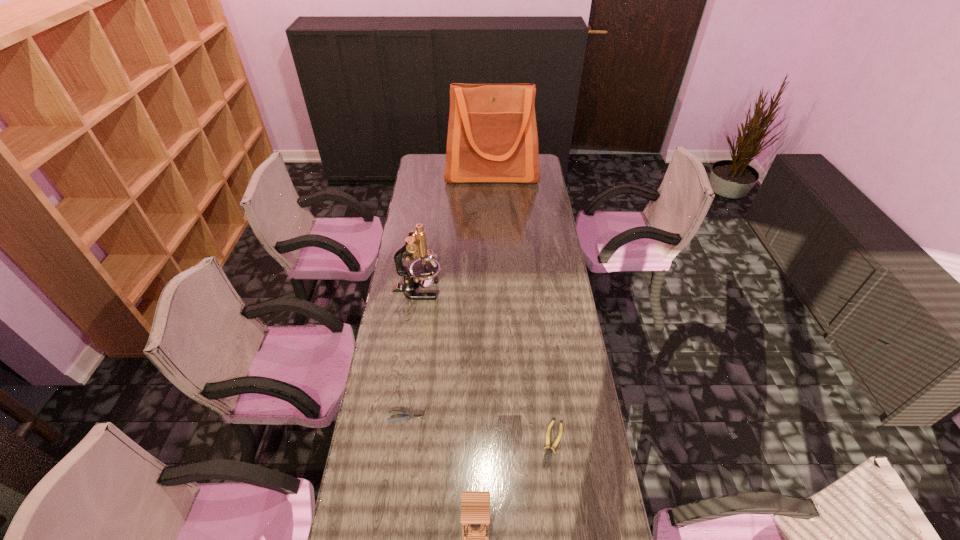
The width and height of the screenshot is (960, 540). I want to click on vacant space located 0.100m on the left of the right pliers, so coord(509,444).

I want to click on object located in the far edge section of the desktop, so click(x=492, y=137).

The image size is (960, 540). Find the location of `microscope that is at the left edge`. microscope that is at the left edge is located at coordinates (423, 271).

I want to click on pliers present at the left edge, so click(x=409, y=415).

This screenshot has height=540, width=960. I want to click on shopping bag that is at the right edge, so click(x=492, y=137).

In order to click on pliers situated at the right edge in this screenshot , I will do `click(547, 456)`.

You are a GUI agent. You are given a task and a screenshot of the screen. Output one action in this format:
    pyautogui.click(x=<x>, y=<y>)
    Task: Click on the object present at the far right corner
    
    Given the screenshot: What is the action you would take?
    pyautogui.click(x=492, y=137)

At what (x,y) coordinates should I click in order to perform the action: click on blank space at the left edge. Please return your answer as a coordinate pair (x, y). This screenshot has width=960, height=540. Looking at the image, I should click on (427, 226).

This screenshot has height=540, width=960. Find the location of `vacant space at the right edge of the desktop`. vacant space at the right edge of the desktop is located at coordinates (549, 384).

This screenshot has width=960, height=540. In the image, there is a desktop. Identify the location of vacant space at the far left corner. (443, 157).